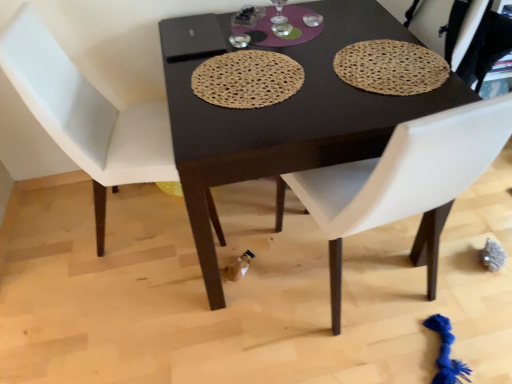
What do you see at coordinates (391, 67) in the screenshot? The image size is (512, 384). I see `brown woven placemat at upper right, the second mat viewed from the left` at bounding box center [391, 67].

You are a GUI agent. You are given a task and a screenshot of the screen. Output one action in this format:
    pyautogui.click(x=<x>, y=<y>)
    Task: Click on the dark brown wood table at center
    
    Given the screenshot: What is the action you would take?
    point(280,113)

This screenshot has width=512, height=384. I want to click on brown woven placemat at upper right, the second mat viewed from the left, so click(391, 67).

Which of these two, white leather chair at center, the 1th chair in the right-to-left sequence, or natural fiber placemat at center, the 1th mat when ordered from left to right, is wider?

white leather chair at center, the 1th chair in the right-to-left sequence.

Does white leather chair at center, the 1th chair in the right-to-left sequence, turn towards natural fiber placemat at center, the 1th mat when ordered from left to right?

No, white leather chair at center, the 1th chair in the right-to-left sequence, is not oriented towards natural fiber placemat at center, the 1th mat when ordered from left to right.

Is point (502, 107) positioned after point (228, 88)?

No, it is not.

Does white leather chair at center, the 1th chair in the right-to-left sequence, contain natural fiber placemat at center, the 1th mat when ordered from left to right?

No, natural fiber placemat at center, the 1th mat when ordered from left to right, is located outside of white leather chair at center, the 1th chair in the right-to-left sequence.

Between brown woven placemat at upper right, placed as the 1th mat when sorted from right to left, and white leather chair at left, the 2th chair positioned from the right, which one has smaller width?

Thinner between the two is brown woven placemat at upper right, placed as the 1th mat when sorted from right to left.

Is brown woven placemat at upper right, placed as the 1th mat when sorted from right to left, not within white leather chair at left, the 2th chair positioned from the right?

brown woven placemat at upper right, placed as the 1th mat when sorted from right to left, lies outside white leather chair at left, the 2th chair positioned from the right,'s area.

From the image's perspective, which is above, brown woven placemat at upper right, the second mat viewed from the left, or white leather chair at left, the 2th chair positioned from the right?

brown woven placemat at upper right, the second mat viewed from the left, is shown above in the image.

From a real-world perspective, is brown woven placemat at upper right, the second mat viewed from the left, on white leather chair at left, the 2th chair positioned from the right?

Indeed, from a real-world perspective, brown woven placemat at upper right, the second mat viewed from the left, stands above white leather chair at left, the 2th chair positioned from the right.

Which is farther, (28, 5) or (394, 195)?

Point (28, 5)

Considering the sizes of white leather chair at left, the 2th chair positioned from the right, and white leather chair at center, the 1th chair in the right-to-left sequence, in the image, is white leather chair at left, the 2th chair positioned from the right, bigger or smaller than white leather chair at center, the 1th chair in the right-to-left sequence,?

Clearly, white leather chair at left, the 2th chair positioned from the right, is smaller in size than white leather chair at center, the 1th chair in the right-to-left sequence.

Is white leather chair at left, the 2th chair positioned from the right, positioned far away from white leather chair at center, positioned as the second chair in left-to-right order?

No.

Does white leather chair at left, arranged as the 1th chair when viewed from the left, contain white leather chair at center, the 1th chair in the right-to-left sequence?

Actually, white leather chair at center, the 1th chair in the right-to-left sequence, is outside white leather chair at left, arranged as the 1th chair when viewed from the left.

Between brown woven placemat at upper right, the second mat viewed from the left, and white leather chair at center, positioned as the second chair in left-to-right order, which one has smaller size?

A: brown woven placemat at upper right, the second mat viewed from the left, is smaller.

From the image's perspective, who appears lower, brown woven placemat at upper right, placed as the 1th mat when sorted from right to left, or white leather chair at center, the 1th chair in the right-to-left sequence?

white leather chair at center, the 1th chair in the right-to-left sequence.

Starting from the brown woven placemat at upper right, placed as the 1th mat when sorted from right to left, which chair is the 1st one to the left? Please provide its 2D coordinates.

[(405, 182)]

Which object is more forward, white leather chair at left, the 2th chair positioned from the right, or brown woven placemat at upper right, the second mat viewed from the left?

white leather chair at left, the 2th chair positioned from the right, is closer to the camera.

Considering the sizes of white leather chair at left, the 2th chair positioned from the right, and brown woven placemat at upper right, placed as the 1th mat when sorted from right to left, in the image, is white leather chair at left, the 2th chair positioned from the right, wider or thinner than brown woven placemat at upper right, placed as the 1th mat when sorted from right to left,?

In the image, white leather chair at left, the 2th chair positioned from the right, appears to be wider than brown woven placemat at upper right, placed as the 1th mat when sorted from right to left.

Does white leather chair at left, arranged as the 1th chair when viewed from the left, appear on the right side of brown woven placemat at upper right, the second mat viewed from the left?

No, white leather chair at left, arranged as the 1th chair when viewed from the left, is not to the right of brown woven placemat at upper right, the second mat viewed from the left.

Is white leather chair at left, the 2th chair positioned from the right, at the back of white leather chair at center, positioned as the second chair in left-to-right order?

No, white leather chair at center, positioned as the second chair in left-to-right order, is not facing the opposite direction of white leather chair at left, the 2th chair positioned from the right.

Is white leather chair at center, the 1th chair in the right-to-left sequence, wider or thinner than white leather chair at left, the 2th chair positioned from the right?

Clearly, white leather chair at center, the 1th chair in the right-to-left sequence, has more width compared to white leather chair at left, the 2th chair positioned from the right.

Looking at this image, is white leather chair at left, arranged as the 1th chair when viewed from the left, completely or partially inside white leather chair at center, the 1th chair in the right-to-left sequence?

No, white leather chair at left, arranged as the 1th chair when viewed from the left, is not surrounded by white leather chair at center, the 1th chair in the right-to-left sequence.

Measure the distance from white leather chair at center, the 1th chair in the right-to-left sequence, to white leather chair at left, arranged as the 1th chair when viewed from the left.

The distance of white leather chair at center, the 1th chair in the right-to-left sequence, from white leather chair at left, arranged as the 1th chair when viewed from the left, is 30.04 inches.

Is natural fiber placemat at center, which appears as the second mat when viewed from the right, wider or thinner than white leather chair at center, the 1th chair in the right-to-left sequence?

natural fiber placemat at center, which appears as the second mat when viewed from the right, is thinner than white leather chair at center, the 1th chair in the right-to-left sequence.

Is natural fiber placemat at center, which appears as the second mat when viewed from the right, not within white leather chair at center, positioned as the second chair in left-to-right order?

Absolutely, natural fiber placemat at center, which appears as the second mat when viewed from the right, is external to white leather chair at center, positioned as the second chair in left-to-right order.

Can you tell me how much natural fiber placemat at center, which appears as the second mat when viewed from the right, and white leather chair at center, positioned as the second chair in left-to-right order, differ in facing direction?

169 degrees.

Is natural fiber placemat at center, the 1th mat when ordered from left to right, facing towards white leather chair at center, the 1th chair in the right-to-left sequence?

No, natural fiber placemat at center, the 1th mat when ordered from left to right, is not oriented towards white leather chair at center, the 1th chair in the right-to-left sequence.

You are a GUI agent. You are given a task and a screenshot of the screen. Output one action in this format:
    pyautogui.click(x=<x>, y=<y>)
    Task: Click on the chair that is the 2nd one below the natural fiber placemat at center, which appears as the second mat when viewed from the right (from a real-world perspective)
    
    Given the screenshot: What is the action you would take?
    coord(405,182)

Where is `the 1st chair positioned below the brown woven placemat at upper right, placed as the 1th mat when sorted from right to left (from the image's perspective)`? The height and width of the screenshot is (384, 512). the 1st chair positioned below the brown woven placemat at upper right, placed as the 1th mat when sorted from right to left (from the image's perspective) is located at coordinates (86, 115).

When comparing their distances from natural fiber placemat at center, the 1th mat when ordered from left to right, does dark brown wood table at center or brown woven placemat at upper right, the second mat viewed from the left, seem closer?

dark brown wood table at center lies closer to natural fiber placemat at center, the 1th mat when ordered from left to right, than the other object.

From the image, which object appears to be nearer to natural fiber placemat at center, the 1th mat when ordered from left to right, brown woven placemat at upper right, placed as the 1th mat when sorted from right to left, or white leather chair at left, the 2th chair positioned from the right?

brown woven placemat at upper right, placed as the 1th mat when sorted from right to left.

Which object lies nearer to the anchor point natural fiber placemat at center, the 1th mat when ordered from left to right, brown woven placemat at upper right, the second mat viewed from the left, or dark brown wood table at center?

The object closer to natural fiber placemat at center, the 1th mat when ordered from left to right, is dark brown wood table at center.

Which object lies nearer to the anchor point dark brown wood table at center, natural fiber placemat at center, which appears as the second mat when viewed from the right, or white leather chair at center, the 1th chair in the right-to-left sequence?

Based on the image, natural fiber placemat at center, which appears as the second mat when viewed from the right, appears to be nearer to dark brown wood table at center.

In the scene shown: When comparing their distances from dark brown wood table at center, does brown woven placemat at upper right, the second mat viewed from the left, or white leather chair at left, the 2th chair positioned from the right, seem closer?

Based on the image, brown woven placemat at upper right, the second mat viewed from the left, appears to be nearer to dark brown wood table at center.

Estimate the real-world distances between objects in this image. Which object is closer to white leather chair at center, the 1th chair in the right-to-left sequence, brown woven placemat at upper right, placed as the 1th mat when sorted from right to left, or dark brown wood table at center?

Among the two, dark brown wood table at center is located nearer to white leather chair at center, the 1th chair in the right-to-left sequence.

When comparing their distances from natural fiber placemat at center, which appears as the second mat when viewed from the right, does white leather chair at left, arranged as the 1th chair when viewed from the left, or brown woven placemat at upper right, the second mat viewed from the left, seem closer?

brown woven placemat at upper right, the second mat viewed from the left, is closer to natural fiber placemat at center, which appears as the second mat when viewed from the right.

Considering their positions, is white leather chair at center, positioned as the second chair in left-to-right order, positioned closer to dark brown wood table at center than brown woven placemat at upper right, placed as the 1th mat when sorted from right to left?

Based on the image, brown woven placemat at upper right, placed as the 1th mat when sorted from right to left, appears to be nearer to dark brown wood table at center.

Identify the location of chair between natural fiber placemat at center, which appears as the second mat when viewed from the right, and brown woven placemat at upper right, the second mat viewed from the left, from left to right. The image size is (512, 384). (405, 182).

Find the location of a particular element. chair between white leather chair at left, the 2th chair positioned from the right, and brown woven placemat at upper right, the second mat viewed from the left, in the horizontal direction is located at coordinates (405, 182).

At what (x,y) coordinates should I click in order to perform the action: click on mat located between white leather chair at left, arranged as the 1th chair when viewed from the left, and dark brown wood table at center in the left-right direction. Please return your answer as a coordinate pair (x, y). This screenshot has height=384, width=512. Looking at the image, I should click on (247, 79).

Locate an element on the screen. This screenshot has width=512, height=384. table between white leather chair at center, the 1th chair in the right-to-left sequence, and natural fiber placemat at center, which appears as the second mat when viewed from the right, along the z-axis is located at coordinates (280, 113).